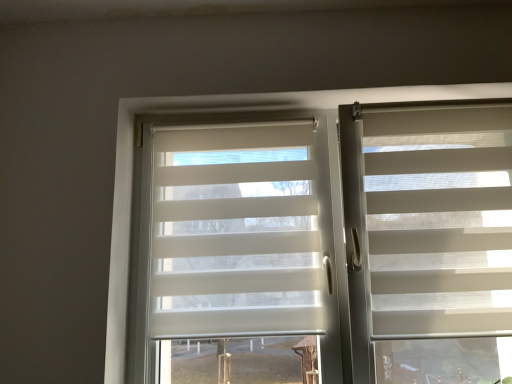
Question: Would you say white translucent blinds at center is to the left or to the right of white translucent roller shade at center in the picture?

Choices:
 (A) right
 (B) left

Answer: (A)

Question: From a real-world perspective, is white translucent blinds at center above or below white translucent roller shade at center?

Choices:
 (A) above
 (B) below

Answer: (B)

Question: Which of these objects is positioned closest to the white translucent roller shade at center?

Choices:
 (A) white textured blind at right
 (B) white translucent blinds at center

Answer: (B)

Question: Which object is positioned farthest from the white textured blind at right?

Choices:
 (A) white translucent roller shade at center
 (B) white translucent blinds at center

Answer: (A)